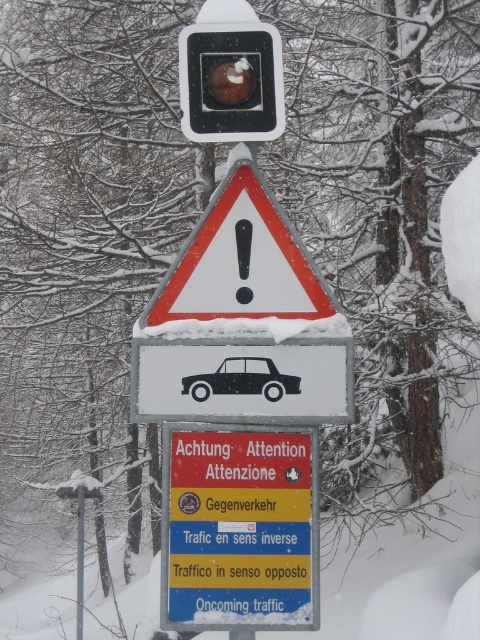
Question: Which object appears closest to the camera in this image?

Choices:
 (A) red plastic sign at center
 (B) white triangular warning sign at center
 (C) black matte car at center

Answer: (A)

Question: Can you confirm if red plastic sign at center is thinner than white triangular warning sign at center?

Choices:
 (A) yes
 (B) no

Answer: (A)

Question: Is red plastic sign at center wider than white triangular warning sign at center?

Choices:
 (A) yes
 (B) no

Answer: (B)

Question: Which point is closer to the camera?

Choices:
 (A) (255, 272)
 (B) (275, 451)

Answer: (B)

Question: Which point is closer to the camera?

Choices:
 (A) black matte car at center
 (B) red plastic sign at center
 (C) white triangular warning sign at center

Answer: (B)

Question: Does red plastic sign at center come behind black matte car at center?

Choices:
 (A) yes
 (B) no

Answer: (B)